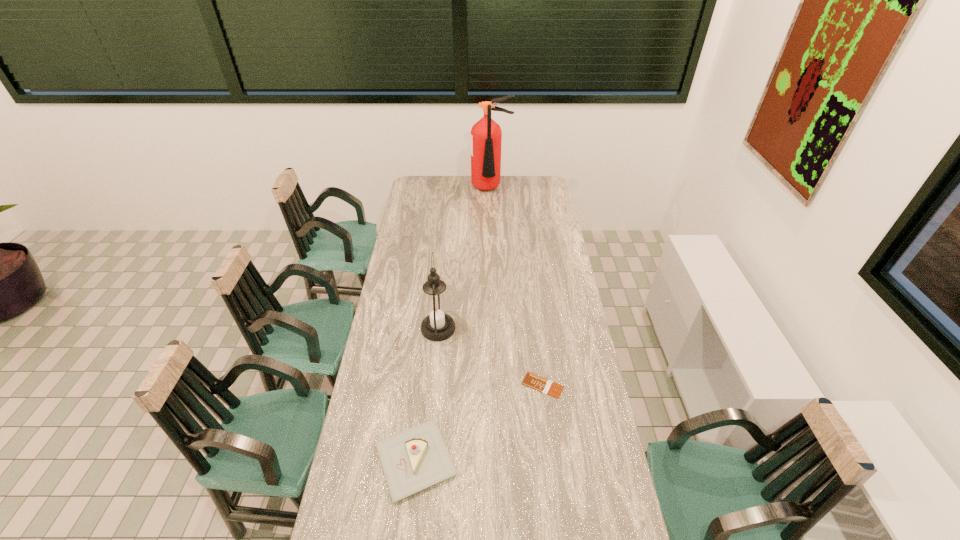
The height and width of the screenshot is (540, 960). I want to click on the farthest object, so click(x=486, y=136).

This screenshot has width=960, height=540. Identify the location of the tallest object. (486, 136).

The height and width of the screenshot is (540, 960). I want to click on the second farthest object, so click(x=436, y=309).

Where is `oil lamp`? This screenshot has width=960, height=540. oil lamp is located at coordinates (436, 309).

Find the location of a particular element. cake is located at coordinates (417, 458).

You are a GUI agent. You are given a task and a screenshot of the screen. Output one action in this format:
    pyautogui.click(x=<x>, y=<y>)
    Task: Click on the third tallest object
    
    Given the screenshot: What is the action you would take?
    pyautogui.click(x=417, y=458)

Locate an element on the screen. This screenshot has height=540, width=960. the shortest object is located at coordinates (534, 381).

Find the location of a particular element. the second nearest object is located at coordinates (534, 381).

You are a GUI agent. You are given a task and a screenshot of the screen. Output one action in this format:
    pyautogui.click(x=<x>, y=<y>)
    Task: Click on the vacant space located 0.340m at the nozzle of the tallest object
    This screenshot has width=960, height=540.
    Given the screenshot: What is the action you would take?
    pyautogui.click(x=492, y=238)

The image size is (960, 540). I want to click on free space located 0.260m on the front of the third nearest object, so pos(431,404).